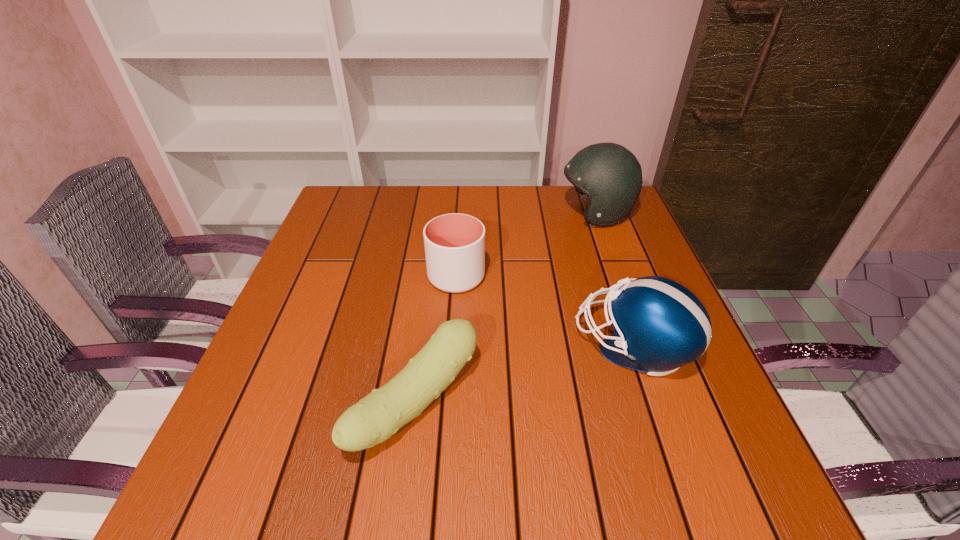
I want to click on vacant area between the tallest object and the third shortest object, so 614,280.

Where is `vacant area between the cup and the tallest object`? vacant area between the cup and the tallest object is located at coordinates (526, 245).

Where is `empty space between the shortest object and the farthest object`? empty space between the shortest object and the farthest object is located at coordinates (506, 308).

This screenshot has width=960, height=540. In order to click on empty location between the tallest object and the shortest object in this screenshot , I will do pyautogui.click(x=506, y=308).

Where is `empty location between the farther football helmet and the shorter football helmet`? This screenshot has height=540, width=960. empty location between the farther football helmet and the shorter football helmet is located at coordinates (614, 280).

Choose which object is the second nearest neighbor to the shortest object. Please provide its 2D coordinates. Your answer should be formatted as a tuple, i.e. [(x, y)], where the tuple contains the x and y coordinates of a point satisfying the conditions above.

[(659, 325)]

Identify which object is the nearest to the shorter football helmet. Please provide its 2D coordinates. Your answer should be formatted as a tuple, i.e. [(x, y)], where the tuple contains the x and y coordinates of a point satisfying the conditions above.

[(454, 243)]

In order to click on free spot that satisfies the following two spatial constraints: 1. on the back side of the cucumber; 2. on the right side of the second farthest object in this screenshot , I will do `click(431, 277)`.